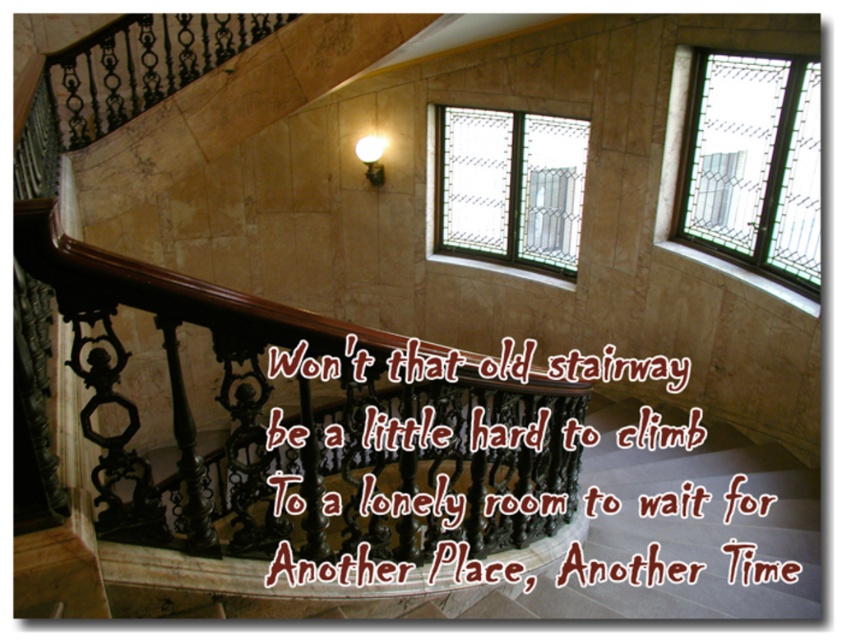
Consider the image. Can you confirm if clear glass window at upper right is thinner than clear glass window at center?

Indeed, clear glass window at upper right has a lesser width compared to clear glass window at center.

Between clear glass window at upper right and clear glass window at center, which one has more height?

clear glass window at upper right

Is point (733, 140) more distant than point (573, 228)?

No, it is not.

Where is `clear glass window at upper right`? clear glass window at upper right is located at coordinates (752, 164).

Does brown polished wood at upper center lie behind polished marble stairs at center?

No, brown polished wood at upper center is in front of polished marble stairs at center.

Is point (73, 253) closer to viewer compared to point (627, 461)?

Yes, it is in front of point (627, 461).

Image resolution: width=842 pixels, height=640 pixels. In order to click on brown polished wood at upper center in this screenshot , I will do `click(302, 429)`.

Between polished marble stairs at center and clear glass window at upper right, which one has less height?

polished marble stairs at center is shorter.

From the picture: Who is positioned more to the left, polished marble stairs at center or clear glass window at upper right?

Positioned to the left is polished marble stairs at center.

Locate an element on the screen. The height and width of the screenshot is (640, 842). polished marble stairs at center is located at coordinates (555, 561).